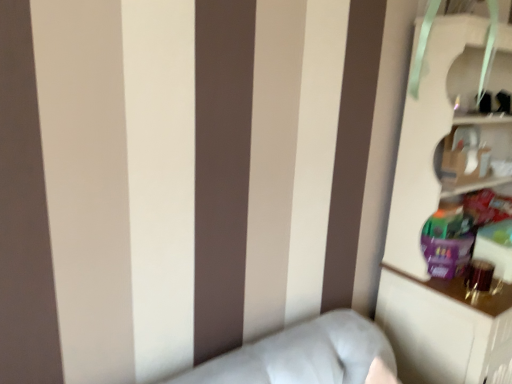
Describe the element at coordinates (476, 155) in the screenshot. Image resolution: width=512 pixels, height=384 pixels. I see `matte cardboard cabinet at upper right` at that location.

Identify the location of matte cardboard cabinet at upper right. (476, 155).

Looking at this image, in order to face matte cardboard cabinet at upper right, should I rotate leftwards or rightwards?

You should rotate right by 26.204 degrees.

In order to face white glossy bookcase at right, should I rotate leftwards or rightwards?

You should rotate right by 29.702 degrees.

Image resolution: width=512 pixels, height=384 pixels. In order to click on white glossy bookcase at right in this screenshot , I will do `click(436, 212)`.

The height and width of the screenshot is (384, 512). What do you see at coordinates (436, 212) in the screenshot?
I see `white glossy bookcase at right` at bounding box center [436, 212].

The image size is (512, 384). What are the coordinates of `matte cardboard cabinet at upper right` in the screenshot? It's located at (476, 155).

Based on their positions, is white glossy bookcase at right located to the left or right of matte cardboard cabinet at upper right?

Based on their positions, white glossy bookcase at right is located to the right of matte cardboard cabinet at upper right.

Considering the positions of objects white glossy bookcase at right and matte cardboard cabinet at upper right in the image provided, who is in front, white glossy bookcase at right or matte cardboard cabinet at upper right?

white glossy bookcase at right is closer to the camera.

Between point (503, 148) and point (463, 128), which one is positioned behind?

The point (503, 148) is behind.

From the image's perspective, would you say white glossy bookcase at right is shown under matte cardboard cabinet at upper right?

Correct, white glossy bookcase at right appears lower than matte cardboard cabinet at upper right in the image.

From a real-world perspective, which is physically below, white glossy bookcase at right or matte cardboard cabinet at upper right?

From a 3D spatial view, white glossy bookcase at right is below.

Consider the image. Which object is wider, white glossy bookcase at right or matte cardboard cabinet at upper right?

Wider between the two is white glossy bookcase at right.

Consider the image. Does white glossy bookcase at right have a greater height compared to matte cardboard cabinet at upper right?

Indeed, white glossy bookcase at right has a greater height compared to matte cardboard cabinet at upper right.

Which of these two, white glossy bookcase at right or matte cardboard cabinet at upper right, is smaller?

Smaller between the two is matte cardboard cabinet at upper right.

Can we say white glossy bookcase at right lies outside matte cardboard cabinet at upper right?

Yes, white glossy bookcase at right is not within matte cardboard cabinet at upper right.

Would you consider white glossy bookcase at right to be distant from matte cardboard cabinet at upper right?

white glossy bookcase at right is near matte cardboard cabinet at upper right, not far away.

Is matte cardboard cabinet at upper right at the back of white glossy bookcase at right?

That's right, white glossy bookcase at right is facing away from matte cardboard cabinet at upper right.

Measure the distance from white glossy bookcase at right to matte cardboard cabinet at upper right.

They are 5.64 inches apart.

This screenshot has height=384, width=512. Find the location of `cabinet on the left of white glossy bookcase at right`. cabinet on the left of white glossy bookcase at right is located at coordinates (476, 155).

Would you say matte cardboard cabinet at upper right is to the left or to the right of white glossy bookcase at right in the picture?

Clearly, matte cardboard cabinet at upper right is on the left of white glossy bookcase at right in the image.

Is matte cardboard cabinet at upper right further to the viewer compared to white glossy bookcase at right?

Yes, the depth of matte cardboard cabinet at upper right is greater than that of white glossy bookcase at right.

Which is closer, (x=487, y=142) or (x=508, y=367)?

Clearly, point (x=487, y=142) is more distant from the camera than point (x=508, y=367).

From the image's perspective, would you say matte cardboard cabinet at upper right is shown under white glossy bookcase at right?

Actually, matte cardboard cabinet at upper right appears above white glossy bookcase at right in the image.

From a real-world perspective, between matte cardboard cabinet at upper right and white glossy bookcase at right, who is vertically lower?

In real-world perspective, white glossy bookcase at right is lower.

Considering the relative sizes of matte cardboard cabinet at upper right and white glossy bookcase at right in the image provided, is matte cardboard cabinet at upper right wider than white glossy bookcase at right?

No.

Is matte cardboard cabinet at upper right shorter than white glossy bookcase at right?

Indeed, matte cardboard cabinet at upper right has a lesser height compared to white glossy bookcase at right.

Does matte cardboard cabinet at upper right have a smaller size compared to white glossy bookcase at right?

Correct, matte cardboard cabinet at upper right occupies less space than white glossy bookcase at right.

Would you say matte cardboard cabinet at upper right contains white glossy bookcase at right?

No, matte cardboard cabinet at upper right does not contain white glossy bookcase at right.

Is matte cardboard cabinet at upper right next to white glossy bookcase at right?

matte cardboard cabinet at upper right and white glossy bookcase at right are clearly separated.

Is matte cardboard cabinet at upper right oriented away from white glossy bookcase at right?

That's right, matte cardboard cabinet at upper right is facing away from white glossy bookcase at right.

Identify the location of cabinet behind the white glossy bookcase at right. (476, 155).

Identify the location of cabinet lying on the left of white glossy bookcase at right. The image size is (512, 384). (476, 155).

You are a GUI agent. You are given a task and a screenshot of the screen. Output one action in this format:
    pyautogui.click(x=<x>, y=<y>)
    Task: Click on the bookcase below the matte cardboard cabinet at upper right (from the image's perspective)
    The width and height of the screenshot is (512, 384).
    Given the screenshot: What is the action you would take?
    pyautogui.click(x=436, y=212)